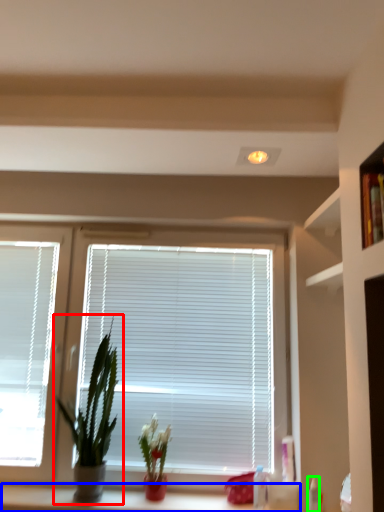
Question: Which object is the farthest from houseplant (highlighted by a red box)? Choose among these: counter (highlighted by a blue box) or toiletry (highlighted by a green box).

Choices:
 (A) counter
 (B) toiletry

Answer: (B)